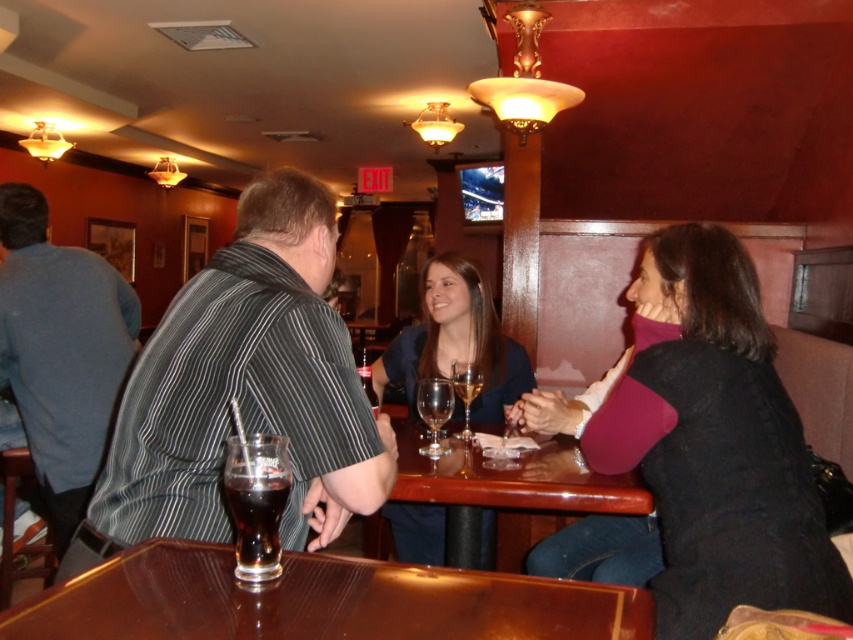
You are sitting at the shiny brown wood table at center and want to reach the glossy wood table at center. Which direction should you move to get there?

The shiny brown wood table at center is in front of the glossy wood table at center, so you should move backward to reach the glossy wood table at center.

You are planning to seat four people at the tables in the scene. Which table, the shiny brown wood table at center or the glossy wood table at center, can accommodate more guests comfortably?

The glossy wood table at center can accommodate more guests comfortably since it occupies more space than the shiny brown wood table at center.